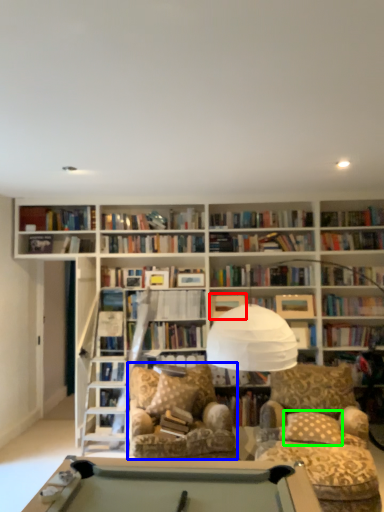
Question: Which object is positioned farthest from paperback book (highlighted by a red box)? Select from swivel chair (highlighted by a blue box) and pillow (highlighted by a green box).

Choices:
 (A) swivel chair
 (B) pillow

Answer: (B)